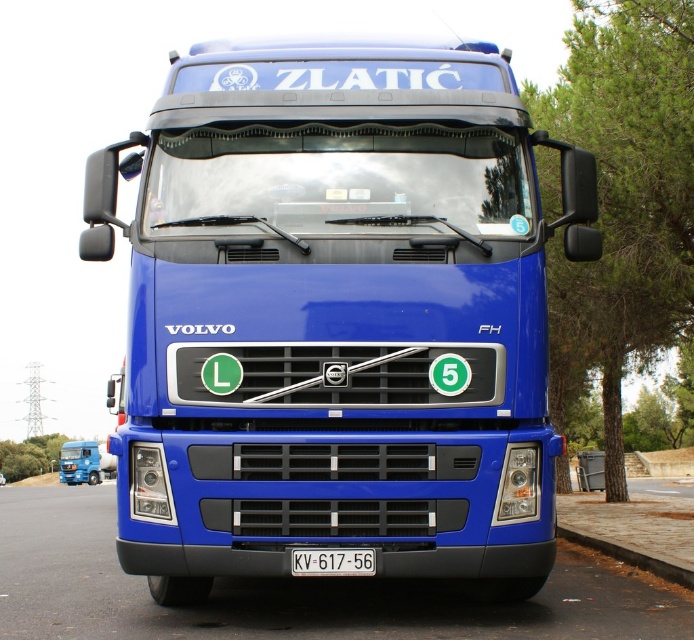
Question: Among these objects, which one is nearest to the camera?

Choices:
 (A) metallic blue truck at lower left
 (B) blue metallic truck at center
 (C) white plastic license plate at center

Answer: (C)

Question: Which of the following is the farthest from the observer?

Choices:
 (A) (92, 460)
 (B) (152, 413)
 (C) (319, 572)

Answer: (A)

Question: Can you confirm if white plastic license plate at center is positioned to the left of metallic blue truck at lower left?

Choices:
 (A) yes
 (B) no

Answer: (B)

Question: Which object is closer to the camera taking this photo?

Choices:
 (A) paved concrete curb at lower right
 (B) blue metallic truck at center

Answer: (B)

Question: Is paved concrete curb at lower right bigger than metallic blue truck at lower left?

Choices:
 (A) yes
 (B) no

Answer: (A)

Question: Does white plastic license plate at center appear under metallic blue truck at lower left?

Choices:
 (A) yes
 (B) no

Answer: (B)